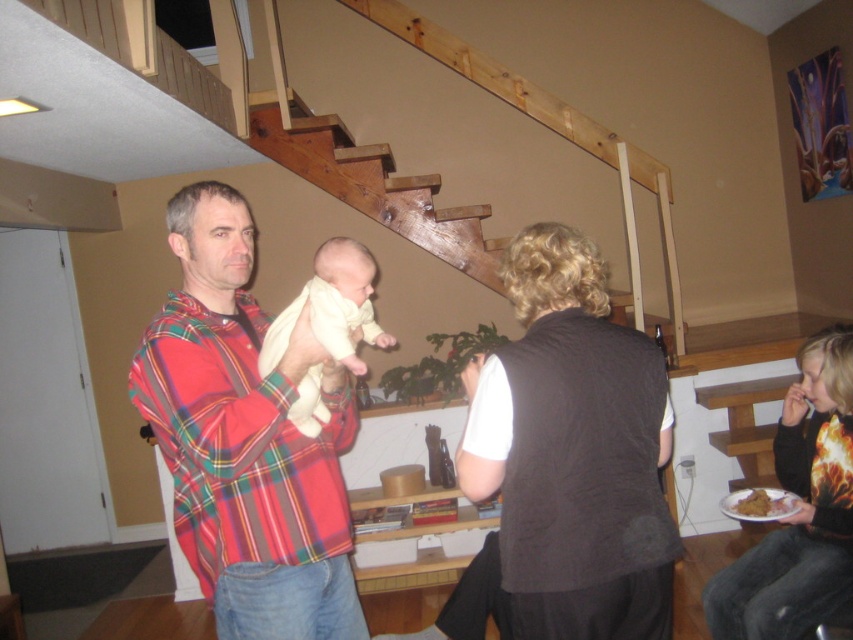
You are standing in the room and want to place a small decorative item between the plaid shirt at center and the golden crispy chicken at lower right. Which object should you place it closer to to ensure it is centered between them?

The plaid shirt at center is taller than the golden crispy chicken at lower right. To center the decorative item between them, place it closer to the golden crispy chicken at lower right since it is shorter and the plaid shirt is taller, balancing their heights.